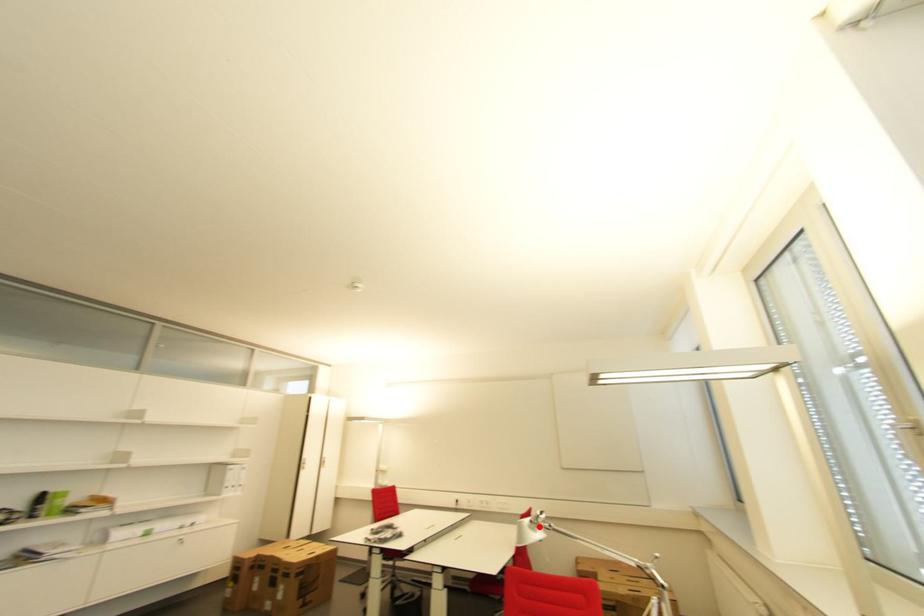
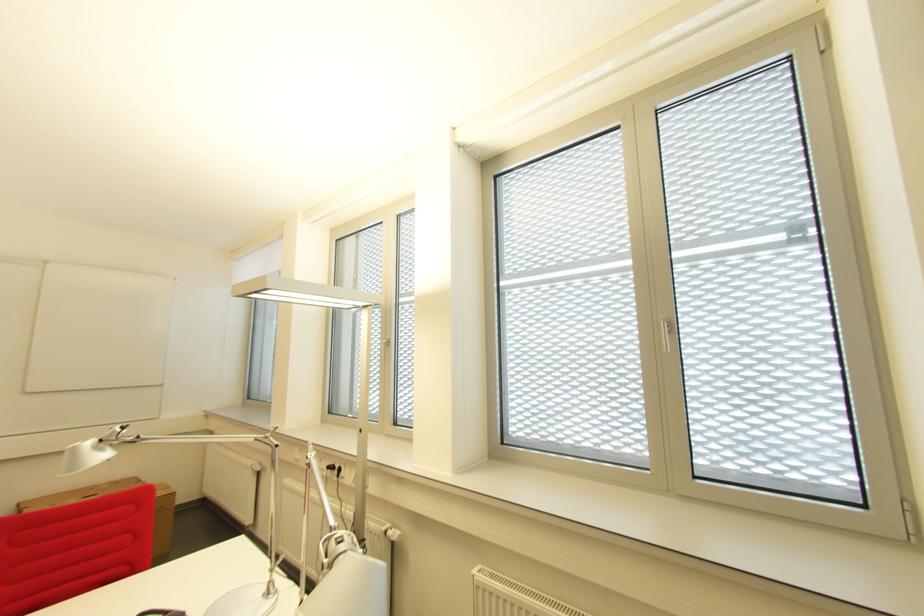
Question: I am providing you with two images of the same scene from different viewpoints. A red point is marked on the first image. At the location where the point appears in image 1, is it still visible in image 2?

Choices:
 (A) Yes
 (B) No

Answer: (A)